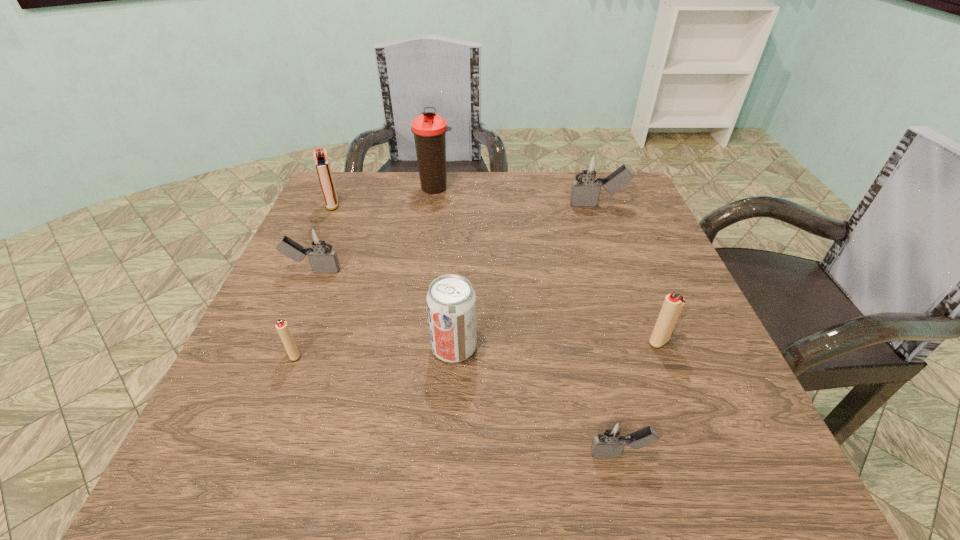
This screenshot has height=540, width=960. I want to click on thermos bottle that is at the far edge, so click(x=429, y=129).

Where is `object that is at the near edge`? object that is at the near edge is located at coordinates (612, 435).

You are a GUI agent. You are given a task and a screenshot of the screen. Output one action in this format:
    pyautogui.click(x=<x>, y=<y>)
    Task: Click on the object that is positioned at the far left corner
    Image resolution: width=960 pixels, height=540 pixels.
    Given the screenshot: What is the action you would take?
    pyautogui.click(x=322, y=164)

What are the coordinates of `object located at the far right corner` in the screenshot? It's located at (585, 192).

Locate an element on the screen. Image resolution: width=960 pixels, height=540 pixels. vacant region at the far edge of the desktop is located at coordinates coord(448,185).

In the image, there is a desktop. Where is `free space at the near edge`? This screenshot has height=540, width=960. free space at the near edge is located at coordinates (526, 453).

In the image, there is a desktop. Where is `vacant space at the left edge`? vacant space at the left edge is located at coordinates (237, 395).

In the image, there is a desktop. Where is `vacant space at the right edge`? vacant space at the right edge is located at coordinates (681, 430).

The image size is (960, 540). In order to click on blank space at the far right corner in this screenshot , I will do `click(594, 216)`.

Where is `free spot between the tallest object and the smallest red igniter`? The width and height of the screenshot is (960, 540). free spot between the tallest object and the smallest red igniter is located at coordinates (365, 271).